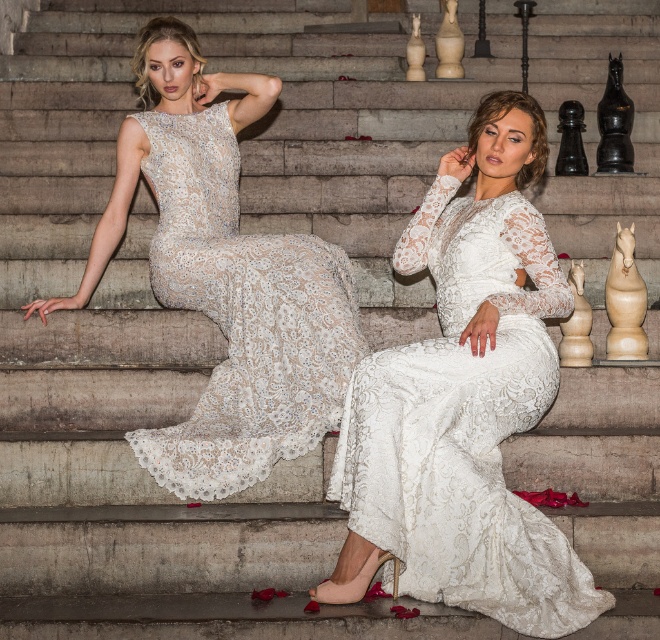
Question: Is white lace dress at center to the right of lace/embroidered dress at center from the viewer's perspective?

Choices:
 (A) no
 (B) yes

Answer: (B)

Question: Does white lace dress at center have a lesser width compared to lace/embroidered dress at center?

Choices:
 (A) no
 (B) yes

Answer: (B)

Question: Does white lace dress at center appear under lace/embroidered dress at center?

Choices:
 (A) no
 (B) yes

Answer: (B)

Question: Which of the following is the closest to the observer?

Choices:
 (A) lace/embroidered dress at center
 (B) white lace dress at center

Answer: (B)